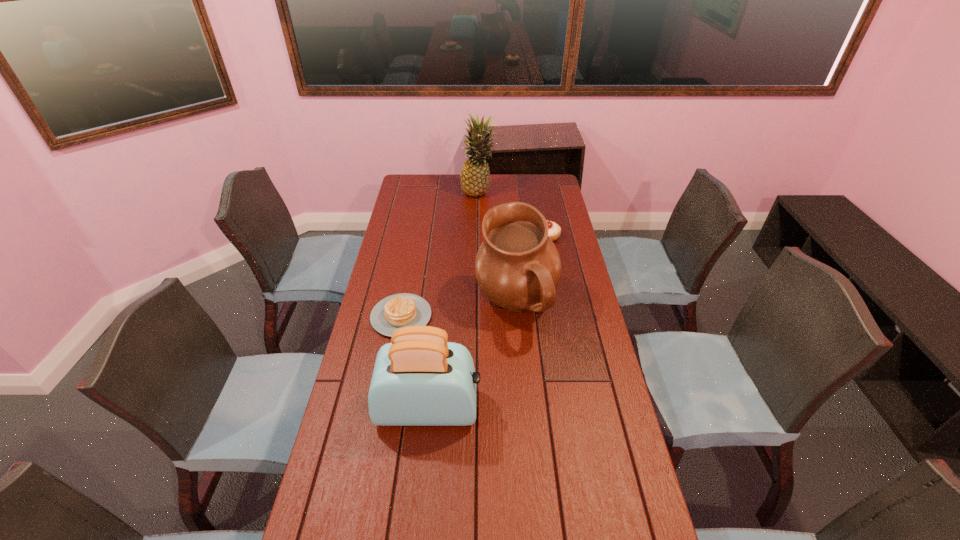
The height and width of the screenshot is (540, 960). I want to click on blank space located 0.130m on the side of the toaster with the lever, so click(525, 408).

At what (x,y) coordinates should I click in order to perform the action: click on blank area located 0.150m on the back of the second farthest object. Please return your answer as a coordinate pair (x, y). The height and width of the screenshot is (540, 960). Looking at the image, I should click on (541, 211).

Where is `vacant point located on the front of the pancake`? Image resolution: width=960 pixels, height=540 pixels. vacant point located on the front of the pancake is located at coordinates (384, 407).

This screenshot has height=540, width=960. I want to click on object located at the far edge, so click(x=475, y=175).

You are a GUI agent. You are given a task and a screenshot of the screen. Output one action in this format:
    pyautogui.click(x=<x>, y=<y>)
    Task: Click on the toaster that is at the left edge
    
    Given the screenshot: What is the action you would take?
    point(419,379)

Locate an element on the screen. pancake that is at the left edge is located at coordinates (396, 311).

You are a GUI agent. You are given a task and a screenshot of the screen. Output one action in this format:
    pyautogui.click(x=<x>, y=<y>)
    Task: Click on the cream pitcher present at the right edge
    The width and height of the screenshot is (960, 540).
    Given the screenshot: What is the action you would take?
    pyautogui.click(x=517, y=267)

Where is `pastry that is at the right edge`? The width and height of the screenshot is (960, 540). pastry that is at the right edge is located at coordinates (554, 232).

Locate an element on the screen. The width and height of the screenshot is (960, 540). vacant space at the far edge is located at coordinates (450, 180).

Identify the location of free space at the left edge. (401, 242).